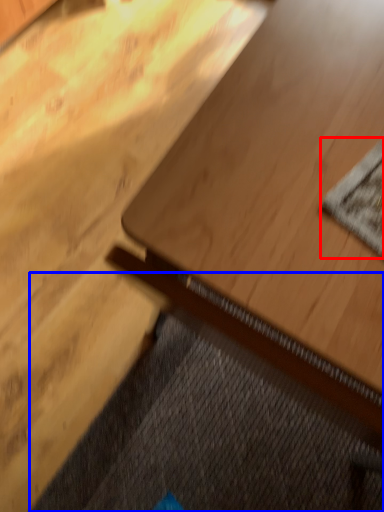
Question: Which object is further to the camera taking this photo, mat (highlighted by a red box) or doormat (highlighted by a blue box)?

Choices:
 (A) mat
 (B) doormat

Answer: (B)